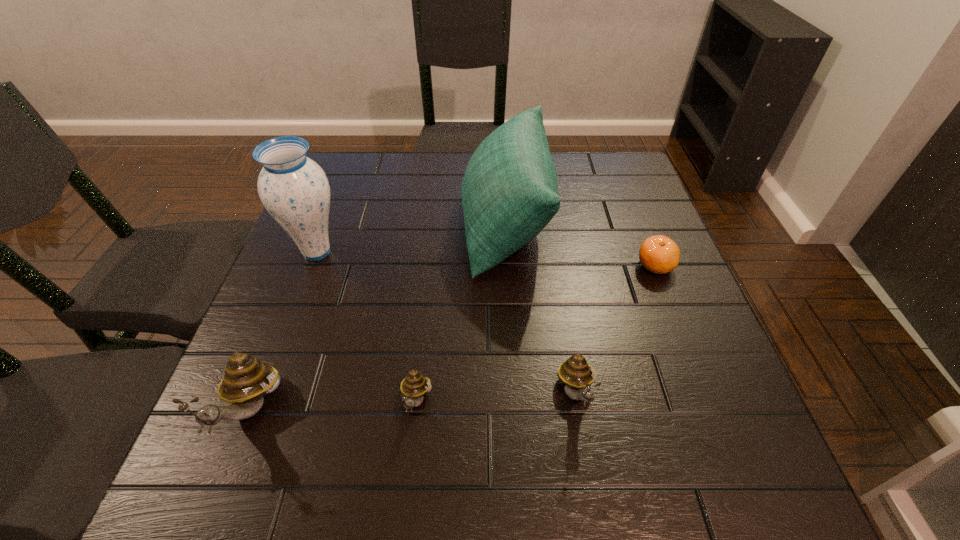
Find the location of a particular element. The width and height of the screenshot is (960, 540). free space between the tallest snail and the cushion is located at coordinates (379, 317).

Where is `empty space between the tallest object and the cushion`? This screenshot has width=960, height=540. empty space between the tallest object and the cushion is located at coordinates (412, 238).

Find the location of a particular element. The height and width of the screenshot is (540, 960). free area in between the vase and the third shortest object is located at coordinates (446, 322).

Where is `unoccupied area between the third tallest object and the third object from left to right`? Image resolution: width=960 pixels, height=540 pixels. unoccupied area between the third tallest object and the third object from left to right is located at coordinates (334, 406).

The image size is (960, 540). In order to click on the closest object to the vase in this screenshot , I will do `click(246, 381)`.

Locate which object is the fourth closest to the vase. Please provide its 2D coordinates. Your answer should be formatted as a tuple, i.e. [(x, y)], where the tuple contains the x and y coordinates of a point satisfying the conditions above.

[(575, 373)]

Locate which snail is the closest to the fourth tallest object. Please provide its 2D coordinates. Your answer should be formatted as a tuple, i.e. [(x, y)], where the tuple contains the x and y coordinates of a point satisfying the conditions above.

[(415, 385)]

Locate which snail is the closest to the rightmost snail. Please provide its 2D coordinates. Your answer should be formatted as a tuple, i.e. [(x, y)], where the tuple contains the x and y coordinates of a point satisfying the conditions above.

[(415, 385)]

The width and height of the screenshot is (960, 540). I want to click on vacant area that satisfies the following two spatial constraints: 1. on the front side of the rightmost object; 2. on the left side of the vase, so click(x=311, y=265).